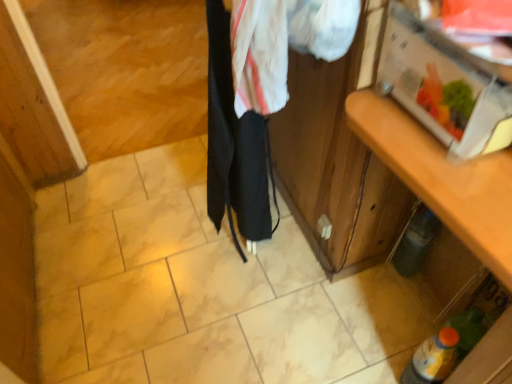
Question: From the image's perspective, is green matte bottle at lower right, which is the 1th bottle in back-to-front order, over wooden cabinet at right?

Choices:
 (A) yes
 (B) no

Answer: (B)

Question: Is green matte bottle at lower right, which is the 1th bottle in back-to-front order, taller than wooden cabinet at right?

Choices:
 (A) no
 (B) yes

Answer: (A)

Question: From a real-world perspective, is green matte bottle at lower right, which is counted as the second bottle, starting from the bottom, positioned under wooden cabinet at right based on gravity?

Choices:
 (A) yes
 (B) no

Answer: (A)

Question: Is green matte bottle at lower right, the 2th bottle when ordered from front to back, to the right of wooden cabinet at right from the viewer's perspective?

Choices:
 (A) no
 (B) yes

Answer: (B)

Question: Does green matte bottle at lower right, which is counted as the second bottle, starting from the bottom, lie behind wooden cabinet at right?

Choices:
 (A) no
 (B) yes

Answer: (B)

Question: From a real-world perspective, is green matte bottle at lower right, which is counted as the second bottle, starting from the bottom, positioned over wooden cabinet at right based on gravity?

Choices:
 (A) yes
 (B) no

Answer: (B)

Question: Considering the relative sizes of yellow-orange plastic bottle at lower right, which ranks as the 1th bottle in front-to-back order, and black fabric at center in the image provided, is yellow-orange plastic bottle at lower right, which ranks as the 1th bottle in front-to-back order, bigger than black fabric at center?

Choices:
 (A) yes
 (B) no

Answer: (B)

Question: From a real-world perspective, is yellow-orange plastic bottle at lower right, the second bottle positioned from the top, over black fabric at center?

Choices:
 (A) no
 (B) yes

Answer: (A)

Question: Considering the relative positions of yellow-orange plastic bottle at lower right, the second bottle positioned from the top, and black fabric at center in the image provided, is yellow-orange plastic bottle at lower right, the second bottle positioned from the top, to the left of black fabric at center from the viewer's perspective?

Choices:
 (A) no
 (B) yes

Answer: (A)

Question: Is yellow-orange plastic bottle at lower right, the second bottle positioned from the top, taller than black fabric at center?

Choices:
 (A) no
 (B) yes

Answer: (A)

Question: Does yellow-orange plastic bottle at lower right, the second bottle positioned from the top, have a greater width compared to black fabric at center?

Choices:
 (A) yes
 (B) no

Answer: (B)

Question: Can you confirm if yellow-orange plastic bottle at lower right, which is the first bottle from bottom to top, is thinner than black fabric at center?

Choices:
 (A) yes
 (B) no

Answer: (A)

Question: Is black fabric at center positioned beyond the bounds of wooden cabinet at right?

Choices:
 (A) no
 (B) yes

Answer: (B)